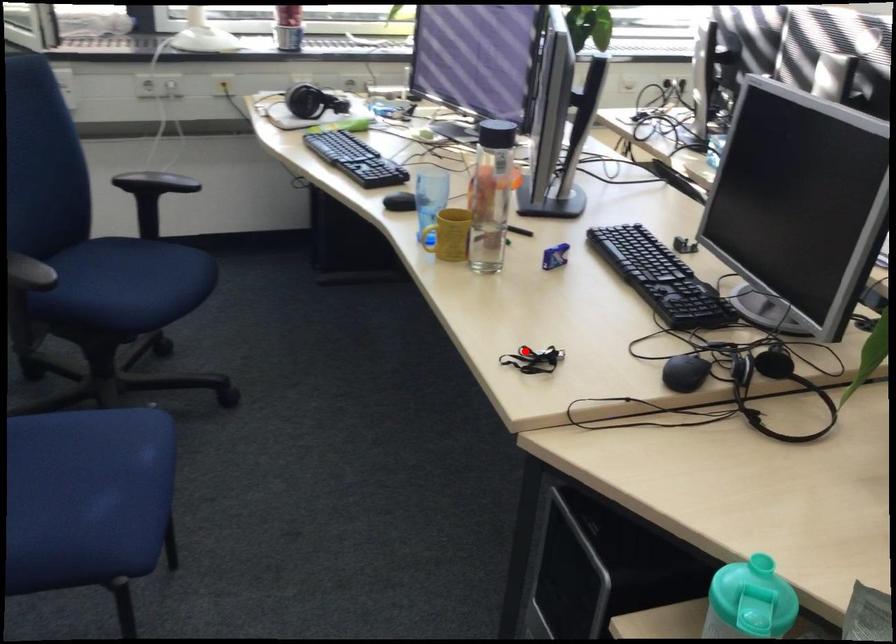
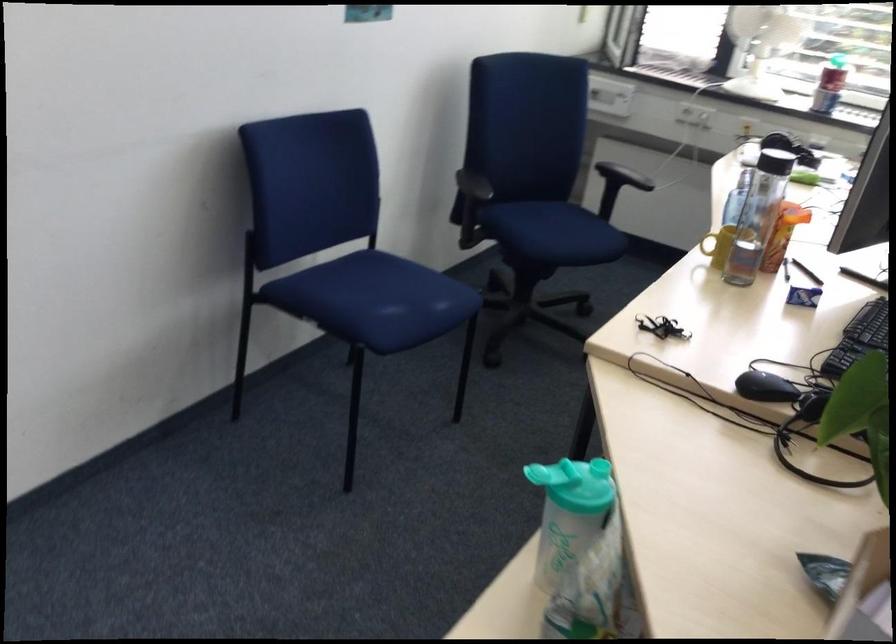
Question: I am providing you with two images of the same scene from different viewpoints. A red point is shown in image1. For the corresponding object point in image2, is it positioned nearer or farther from the camera?

Choices:
 (A) Nearer
 (B) Farther

Answer: (B)